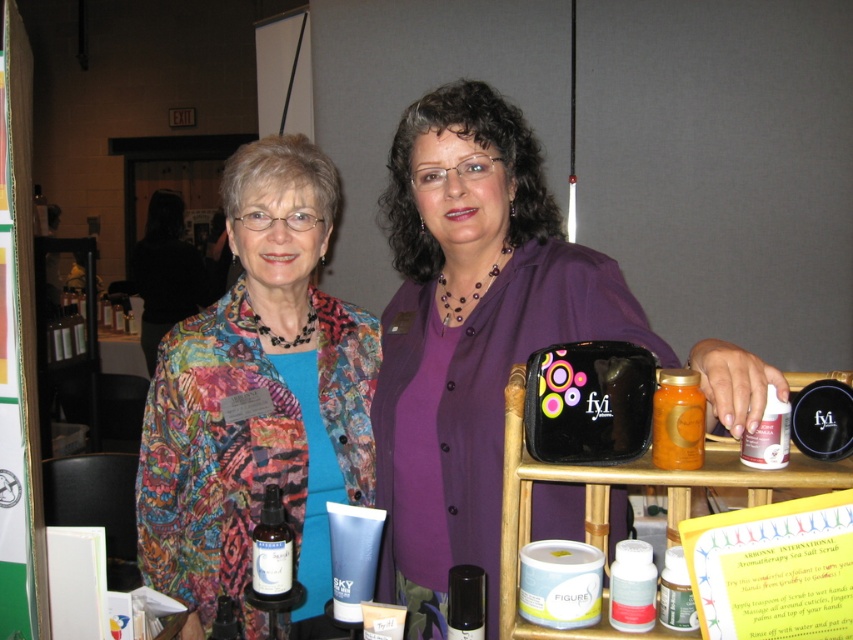
You are a customer at the trade show booth and want to place the translucent glass spray bottle at center on top of the purple matte shirt at center. Can the spray bottle fit horizontally on the shirt without hanging off the edges?

The purple matte shirt at center might be wider than translucent glass spray bottle at center, so there is a possibility that the spray bottle can fit horizontally on the shirt without hanging off the edges. However, since the exact width difference isn not specified, it is uncertain. Please check the actual dimensions for confirmation.

You are a photographer standing at the booth. You want to take a photo of the purple matte shirt at center so that it appears sharp. If your camera focuses best at 36 inches, should you move closer or farther away?

The purple matte shirt at center is currently 34.52 inches from the camera, which is closer than the optimal 36 inches. To ensure it appears sharp, you should move slightly farther away to reach the ideal focusing distance.